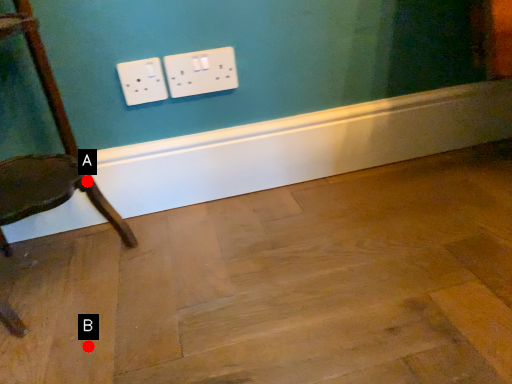
Question: Two points are circled on the image, labeled by A and B beside each circle. Which point is closer to the camera taking this photo?

Choices:
 (A) A is closer
 (B) B is closer

Answer: (B)